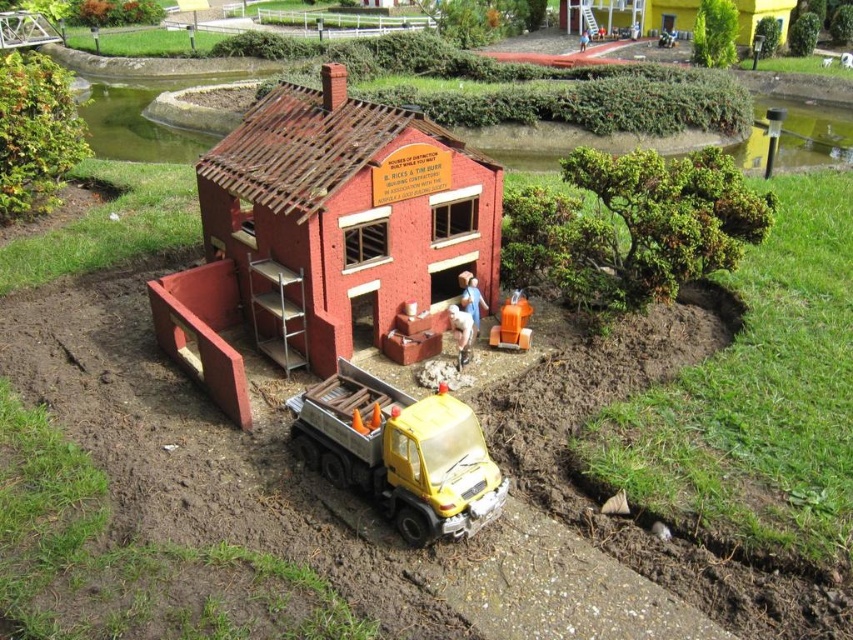
Does point (398, 134) lie in front of point (654, 1)?

Yes, it is in front of point (654, 1).

Measure the distance between point (225, 156) and camera.

Point (225, 156) and camera are 8.50 meters apart.

What are the coordinates of `brick textured house at center` in the screenshot? It's located at (323, 232).

How distant is brick textured house at center from orange plastic barrel at center?

The distance of brick textured house at center from orange plastic barrel at center is 1.99 meters.

This screenshot has height=640, width=853. Identify the location of brick textured house at center. (323, 232).

Is point (340, 264) positioned behind point (498, 321)?

That is False.

At what (x,y) coordinates should I click in order to perform the action: click on brick textured house at center. Please return your answer as a coordinate pair (x, y). The width and height of the screenshot is (853, 640). Looking at the image, I should click on (323, 232).

From the picture: Can you confirm if brick textured house at center is positioned below yellow matte truck at lower center?

Incorrect, brick textured house at center is not positioned below yellow matte truck at lower center.

Consider the image. Does brick textured house at center have a larger size compared to yellow matte truck at lower center?

Correct, brick textured house at center is larger in size than yellow matte truck at lower center.

Does point (482, 243) come closer to viewer compared to point (363, 452)?

That is False.

Image resolution: width=853 pixels, height=640 pixels. What are the coordinates of `brick textured house at center` in the screenshot? It's located at (323, 232).